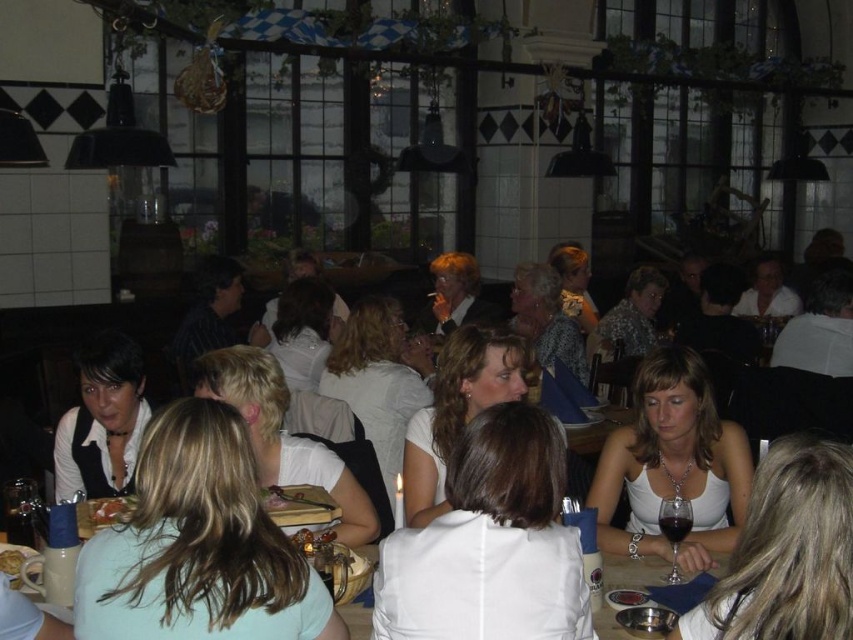
Can you confirm if white matte shirt at lower left is positioned to the left of golden brown bread at lower left?

No, white matte shirt at lower left is not to the left of golden brown bread at lower left.

Is white matte shirt at lower left smaller than golden brown bread at lower left?

Actually, white matte shirt at lower left might be larger than golden brown bread at lower left.

Does point (236, 426) lie behind point (15, 563)?

No, it is not.

The width and height of the screenshot is (853, 640). Identify the location of white matte shirt at lower left. (198, 545).

Which is below, white matte shirt at lower left or white matte tank top at center?

white matte tank top at center is lower down.

Does white matte shirt at lower left have a lesser width compared to white matte tank top at center?

In fact, white matte shirt at lower left might be wider than white matte tank top at center.

Does point (149, 509) come closer to viewer compared to point (659, 365)?

Yes.

The height and width of the screenshot is (640, 853). I want to click on white matte shirt at lower left, so click(x=198, y=545).

This screenshot has width=853, height=640. In order to click on white fabric shirt at center in this screenshot , I will do `click(490, 544)`.

Which is more to the left, white fabric shirt at center or white matte plate at center?

Positioned to the left is white matte plate at center.

Is point (483, 566) positioned behind point (112, 499)?

No, (483, 566) is in front of (112, 499).

Locate an element on the screen. The height and width of the screenshot is (640, 853). white fabric shirt at center is located at coordinates (490, 544).